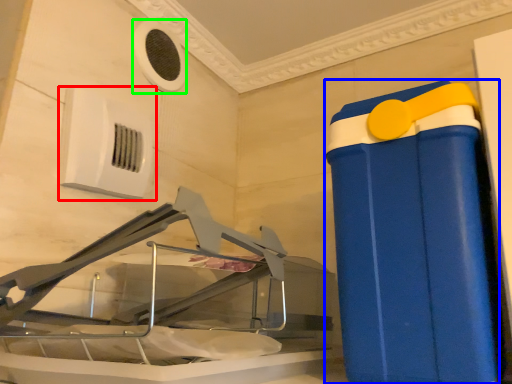
Question: Which object is positioned closest to air conditioning (highlighted by a red box)? Select from waste container (highlighted by a blue box) and air conditioning (highlighted by a green box).

Choices:
 (A) waste container
 (B) air conditioning

Answer: (B)